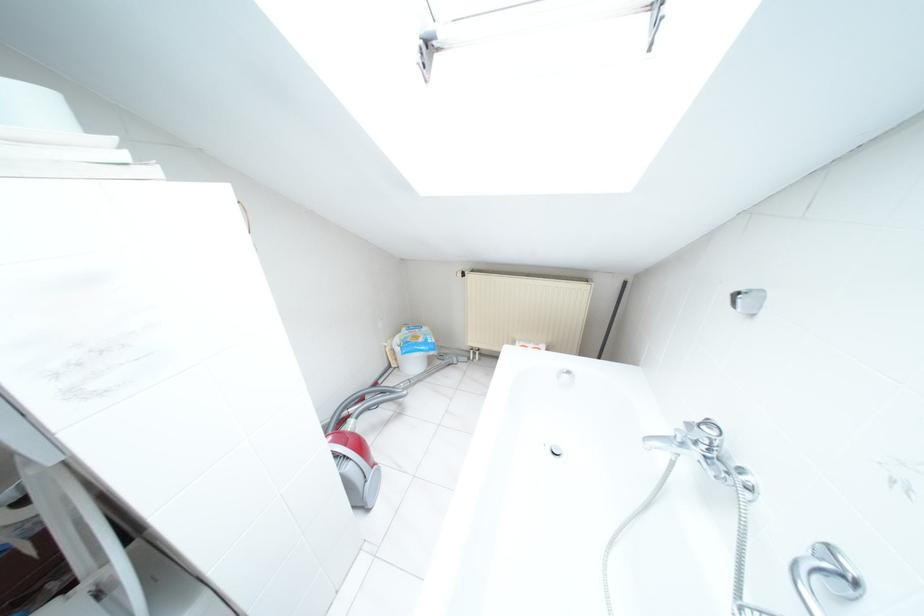
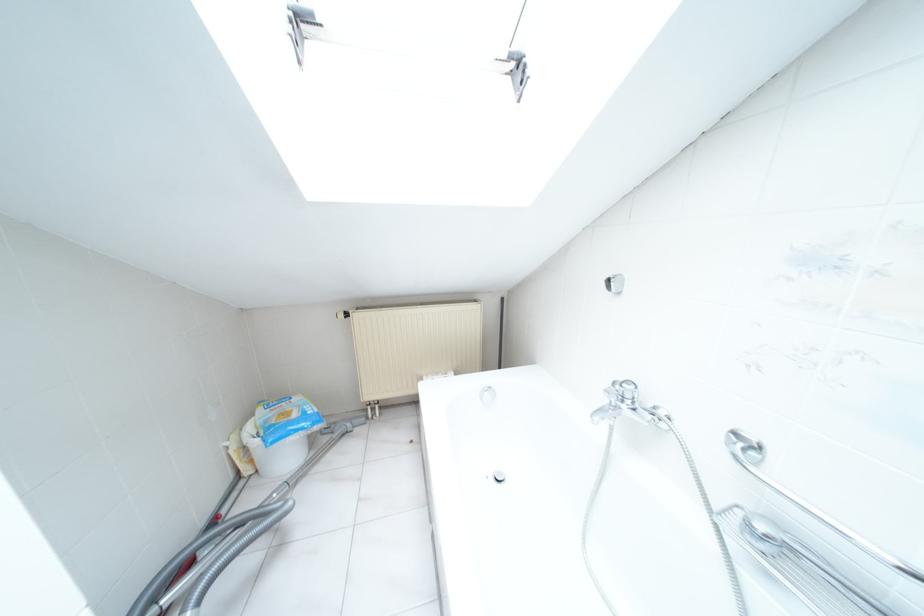
Question: How did the camera likely rotate?

Choices:
 (A) Left
 (B) Right
 (C) Up
 (D) Down

Answer: (B)